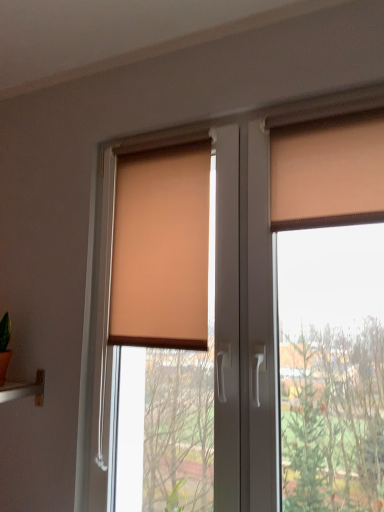
Question: Is matte orange roller blind at center not within beige fabric blind at center?

Choices:
 (A) yes
 (B) no

Answer: (A)

Question: Is matte orange roller blind at center looking in the opposite direction of beige fabric blind at center?

Choices:
 (A) yes
 (B) no

Answer: (A)

Question: Is matte orange roller blind at center far away from beige fabric blind at center?

Choices:
 (A) yes
 (B) no

Answer: (B)

Question: Could you tell me if matte orange roller blind at center is turned towards beige fabric blind at center?

Choices:
 (A) yes
 (B) no

Answer: (A)

Question: From the image's perspective, is matte orange roller blind at center located above beige fabric blind at center?

Choices:
 (A) no
 (B) yes

Answer: (A)

Question: Considering their positions, is matte orange curtain at upper right located in front of or behind beige fabric blind at center?

Choices:
 (A) front
 (B) behind

Answer: (A)

Question: Is matte orange curtain at upper right situated inside beige fabric blind at center or outside?

Choices:
 (A) outside
 (B) inside

Answer: (A)

Question: Is matte orange curtain at upper right taller or shorter than beige fabric blind at center?

Choices:
 (A) short
 (B) tall

Answer: (A)

Question: From a real-world perspective, is matte orange curtain at upper right above or below beige fabric blind at center?

Choices:
 (A) below
 (B) above

Answer: (B)

Question: Is matte orange roller blind at center situated inside matte orange curtain at upper right or outside?

Choices:
 (A) outside
 (B) inside

Answer: (A)

Question: Is matte orange roller blind at center taller or shorter than matte orange curtain at upper right?

Choices:
 (A) tall
 (B) short

Answer: (A)

Question: From the image's perspective, is matte orange roller blind at center above or below matte orange curtain at upper right?

Choices:
 (A) below
 (B) above

Answer: (A)

Question: Is matte orange roller blind at center in front of or behind matte orange curtain at upper right in the image?

Choices:
 (A) behind
 (B) front

Answer: (B)

Question: From the image's perspective, relative to beige fabric blind at center, is matte orange roller blind at center above or below?

Choices:
 (A) above
 (B) below

Answer: (B)

Question: Considering the positions of matte orange roller blind at center and beige fabric blind at center in the image, is matte orange roller blind at center bigger or smaller than beige fabric blind at center?

Choices:
 (A) big
 (B) small

Answer: (A)